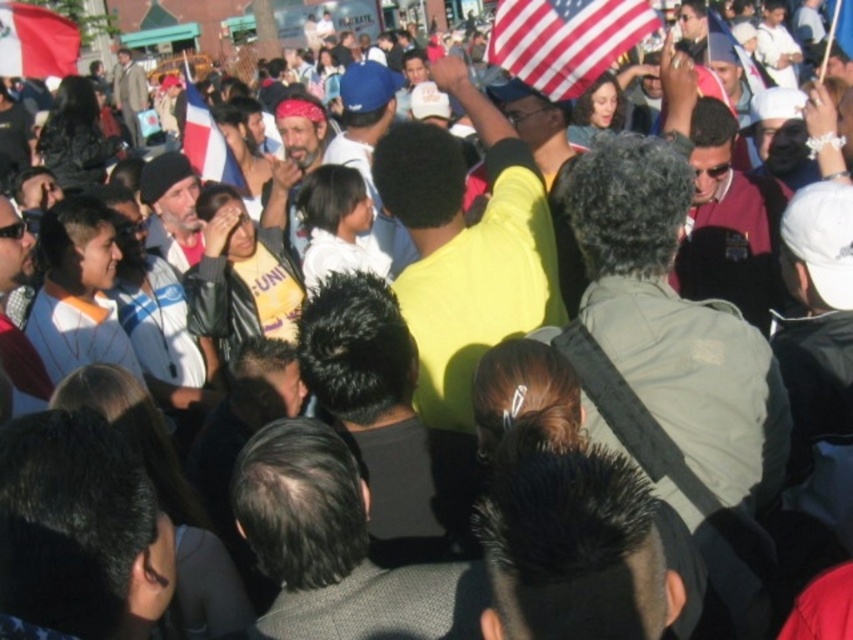
You are a photographer trying to capture a clear shot of both the white fabric flag at center and the blue fabric flag at upper right in the crowd. Which flag should you focus on first to ensure both are visible in your photo?

The white fabric flag at center is in front of the blue fabric flag at upper right, so you should focus on capturing the blue fabric flag at upper right first to ensure it doesn not get obscured by the white flag.

You are a photographer trying to capture both the white fabric flag at center and the blue fabric flag at upper right in a single shot. Based on their positions, which flag will appear closer to the bottom of the photo?

The white fabric flag at center will appear closer to the bottom of the photo because it is positioned under the blue fabric flag at upper right.

You are a photographer trying to capture both the red fabric flag at upper left and the blue fabric flag at upper right in a single frame. Given that your camera can only focus on objects within a 1.5 meter width, will you be able to fit both flags in the frame?

The red fabric flag at upper left is narrower than the blue fabric flag at upper right. However, since the camera requires both flags to be within a 1.5 meter width, it depends on the combined width of both flags. If their total width exceeds 1.5 meters, they won